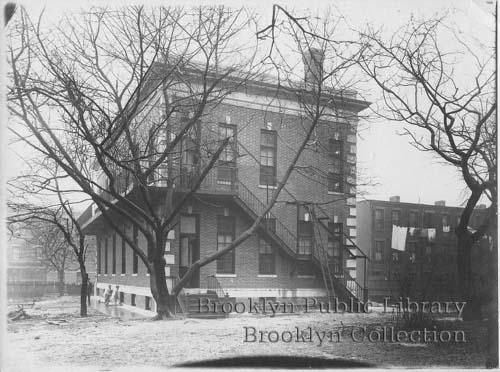
Locate an element on the screen. This screenshot has height=372, width=500. bottom floor front left window is located at coordinates (225, 263).